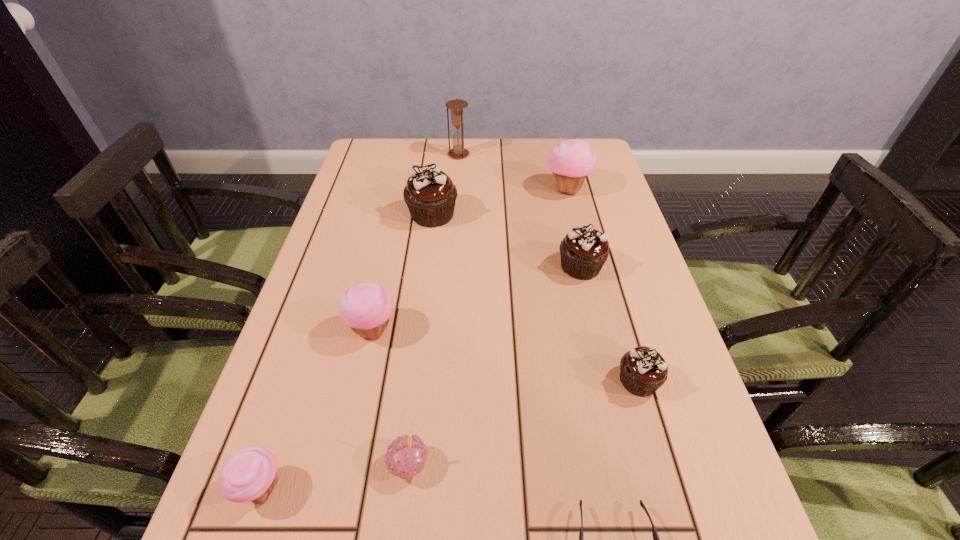
Locate an element on the screen. This screenshot has width=960, height=540. unoccupied position between the biggest brown cupcake and the second nearest brown cupcake is located at coordinates (506, 241).

The height and width of the screenshot is (540, 960). I want to click on vacant region between the second pink cupcake from right to left and the farthest pink cupcake, so click(x=488, y=327).

Locate an element on the screen. This screenshot has height=540, width=960. free space between the sixth nearest object and the leftmost brown cupcake is located at coordinates (506, 241).

I want to click on vacant space in between the farthest object and the sixth farthest object, so click(548, 268).

You are a GUI agent. You are given a task and a screenshot of the screen. Output one action in this format:
    pyautogui.click(x=<x>, y=<y>)
    Task: Click on the vacant area between the fourth nearest cupcake and the second pink cupcake from right to left
    
    Given the screenshot: What is the action you would take?
    pyautogui.click(x=391, y=398)

The height and width of the screenshot is (540, 960). In order to click on object identified as the fifth closest to the smallest brown cupcake in this screenshot , I will do `click(430, 194)`.

This screenshot has height=540, width=960. What are the coordinates of `object that is the eighth closest to the third pink cupcake from left to right` in the screenshot? It's located at 457,119.

I want to click on cupcake that is the third closest to the sixth nearest object, so click(430, 194).

Find the location of a particular element. Image resolution: width=960 pixels, height=540 pixels. cupcake that stands as the sixth closest to the farthest object is located at coordinates (406, 456).

Choose which brown cupcake is the second nearest neighbor to the farthest pink cupcake. Please provide its 2D coordinates. Your answer should be formatted as a tuple, i.e. [(x, y)], where the tuple contains the x and y coordinates of a point satisfying the conditions above.

[(430, 194)]